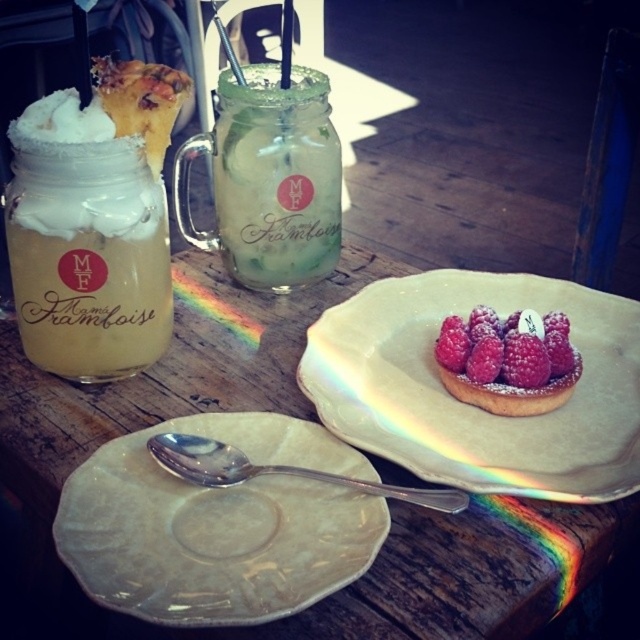
You are a food delivery person who needs to pick up the translucent glass jar at upper left and the pink sugared tart at center from the table. Which item should you grab first to avoid blocking the other?

You should grab the translucent glass jar at upper left first because it is in front of the pink sugared tart at center, so removing it first will allow access to the tart behind.

You are a food blogger who wants to take a photo of the translucent glass jar at upper left and the pink sugared tart at center. To ensure both items are in focus, you need to know which one is taller. Which item is taller?

The translucent glass jar at upper left is taller than the pink sugared tart at center according to the description.